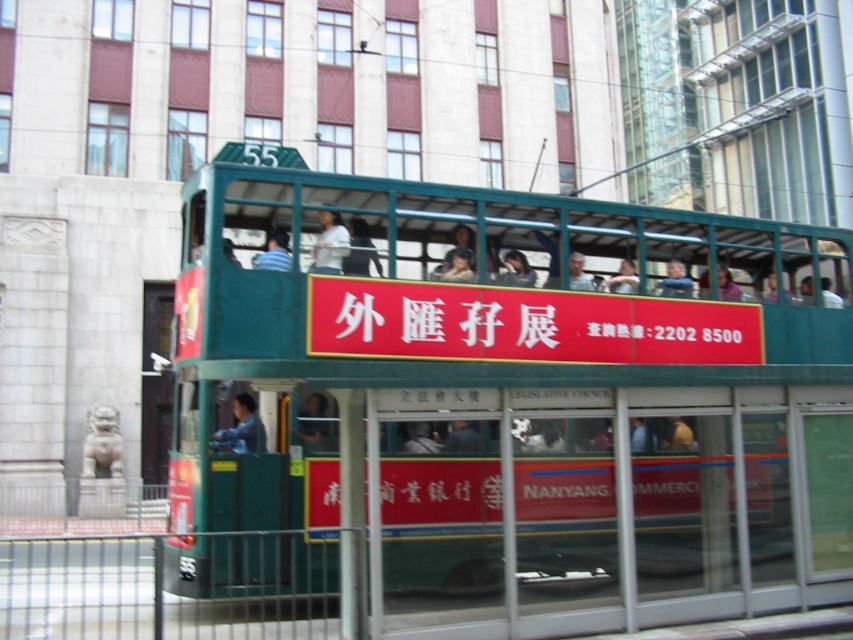
You are a delivery person carrying a box that requires a minimum clearance of 4 meters to pass through. You need to move between the matte blue shirt at center and the matte green bus at center. Can you safely pass through the space between them with your box?

The distance between the matte blue shirt at center and the matte green bus at center is 3.59 meters, which is less than the required 4 meters clearance. Therefore, you cannot safely pass through the space between them with your box.

You are a passenger on the lower level of the double decker tram. You notice a blue striped shirt at center and a matte green bus at center. Which object is located to the left of the other?

The blue striped shirt at center is positioned on the left side of matte green bus at center.